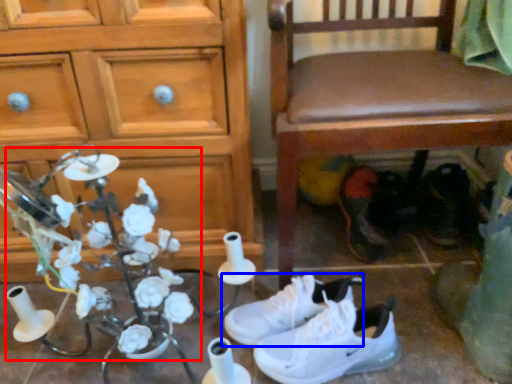
Question: Which object appears farthest to the camera in this image, floral arrangement (highlighted by a red box) or footwear (highlighted by a blue box)?

Choices:
 (A) floral arrangement
 (B) footwear

Answer: (B)